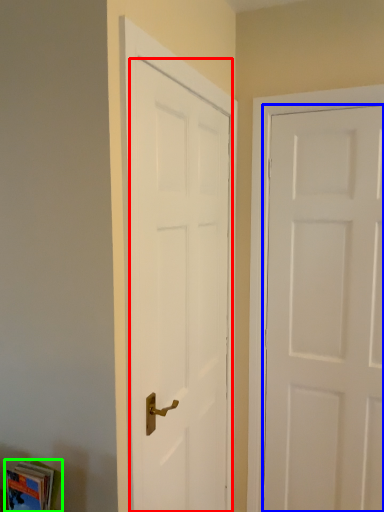
Question: Considering the real-world distances, which object is farthest from door (highlighted by a red box)? door (highlighted by a blue box) or book (highlighted by a green box)?

Choices:
 (A) door
 (B) book

Answer: (B)